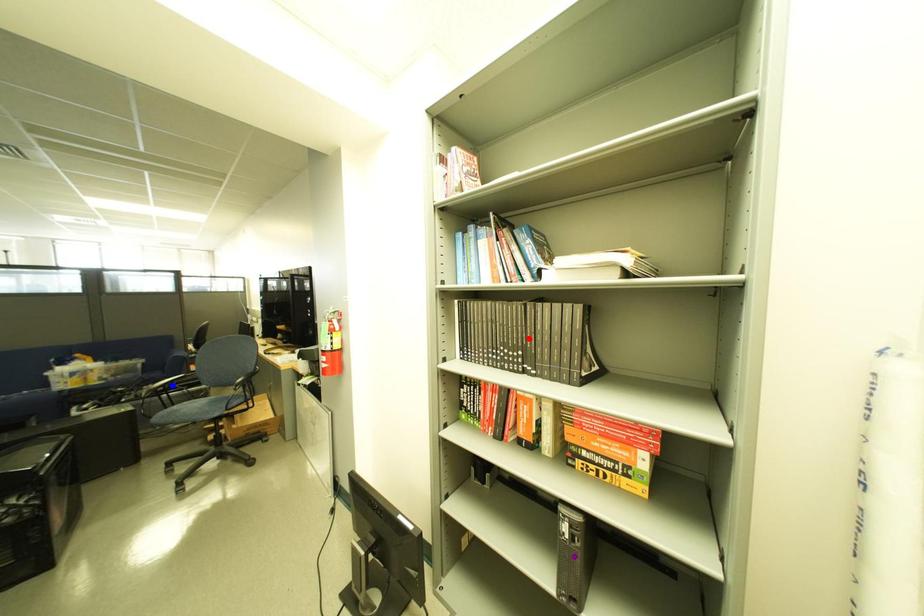
Order these from nearest to farthest:
1. blue point
2. red point
3. purple point

1. purple point
2. red point
3. blue point